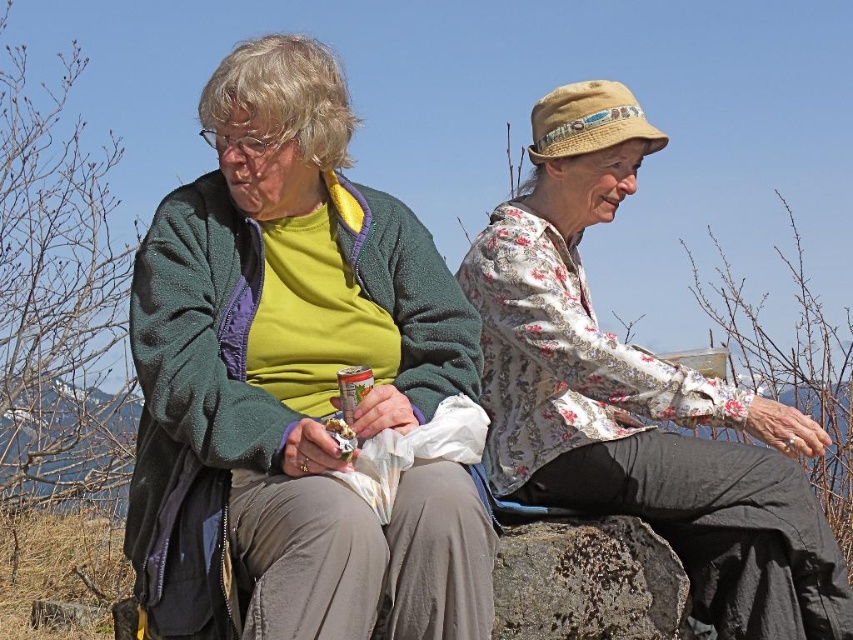
Question: Can you confirm if floral fabric blouse at upper right is smaller than rusty stone boulder at center?

Choices:
 (A) yes
 (B) no

Answer: (B)

Question: Does floral fabric blouse at upper right appear on the left side of rusty stone boulder at center?

Choices:
 (A) no
 (B) yes

Answer: (A)

Question: Where is floral fabric blouse at upper right located in relation to rusty stone boulder at center in the image?

Choices:
 (A) below
 (B) above

Answer: (B)

Question: Which object appears farthest from the camera in this image?

Choices:
 (A) floral fabric blouse at upper right
 (B) rusty stone boulder at center

Answer: (A)

Question: Which of the following is the farthest from the observer?

Choices:
 (A) (651, 145)
 (B) (607, 628)

Answer: (A)